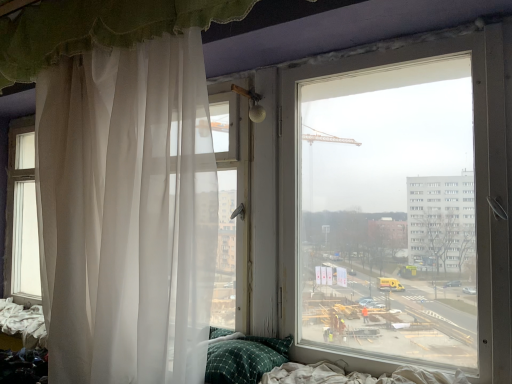
Question: Does white sheer curtain at upper left, the first curtain positioned from the top, have a greater width compared to green checkered pillow at lower center?

Choices:
 (A) yes
 (B) no

Answer: (B)

Question: Can we say white sheer curtain at upper left, the second curtain from the bottom, lies outside green checkered pillow at lower center?

Choices:
 (A) no
 (B) yes

Answer: (B)

Question: Does white sheer curtain at upper left, the second curtain from the bottom, come behind green checkered pillow at lower center?

Choices:
 (A) no
 (B) yes

Answer: (A)

Question: Is white sheer curtain at upper left, the second curtain from the bottom, to the left of green checkered pillow at lower center from the viewer's perspective?

Choices:
 (A) no
 (B) yes

Answer: (B)

Question: From the image's perspective, is white sheer curtain at upper left, the second curtain from the bottom, under green checkered pillow at lower center?

Choices:
 (A) no
 (B) yes

Answer: (A)

Question: Is there a large distance between white sheer curtain at upper left, the second curtain from the bottom, and green checkered pillow at lower center?

Choices:
 (A) no
 (B) yes

Answer: (B)

Question: Would you say white sheer curtain at upper left, the second curtain from the bottom, is part of white sheer curtain at left, marked as the second curtain in a top-to-bottom arrangement,'s contents?

Choices:
 (A) no
 (B) yes

Answer: (A)

Question: Is white sheer curtain at left, marked as the second curtain in a top-to-bottom arrangement, bigger than white sheer curtain at upper left, the second curtain from the bottom?

Choices:
 (A) yes
 (B) no

Answer: (A)

Question: Is white sheer curtain at upper left, the first curtain positioned from the top, at the back of white sheer curtain at left, positioned as the 1th curtain in bottom-to-top order?

Choices:
 (A) no
 (B) yes

Answer: (A)

Question: Can you confirm if white sheer curtain at left, positioned as the 1th curtain in bottom-to-top order, is wider than white sheer curtain at upper left, the first curtain positioned from the top?

Choices:
 (A) yes
 (B) no

Answer: (A)

Question: From a real-world perspective, is white sheer curtain at left, positioned as the 1th curtain in bottom-to-top order, below white sheer curtain at upper left, the first curtain positioned from the top?

Choices:
 (A) yes
 (B) no

Answer: (A)

Question: From the image's perspective, is white sheer curtain at left, marked as the second curtain in a top-to-bottom arrangement, over white sheer curtain at upper left, the first curtain positioned from the top?

Choices:
 (A) yes
 (B) no

Answer: (B)

Question: From a real-world perspective, is green checkered pillow at lower center positioned under white sheer curtain at upper left, the first curtain positioned from the top, based on gravity?

Choices:
 (A) yes
 (B) no

Answer: (A)